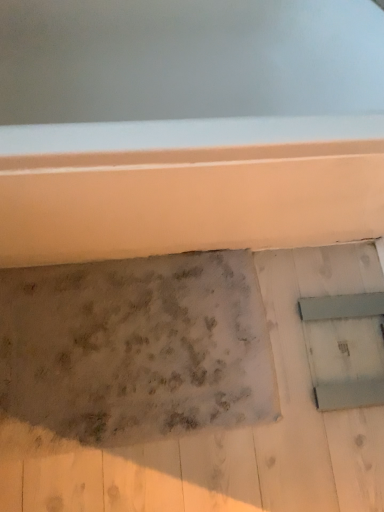
Locate an element on the screen. speckled concrete wall at center is located at coordinates (132, 350).

Image resolution: width=384 pixels, height=512 pixels. What do you see at coordinates (132, 350) in the screenshot? I see `speckled concrete wall at center` at bounding box center [132, 350].

Measure the distance between point [369,346] and camera.

Point [369,346] and camera are 4.05 feet apart.

The height and width of the screenshot is (512, 384). Identify the location of metallic gray window at lower right. (x=349, y=368).

The image size is (384, 512). What do you see at coordinates (349, 368) in the screenshot?
I see `metallic gray window at lower right` at bounding box center [349, 368].

Image resolution: width=384 pixels, height=512 pixels. I want to click on speckled concrete wall at center, so click(x=132, y=350).

Does speckled concrete wall at center appear on the right side of metallic gray window at lower right?

In fact, speckled concrete wall at center is to the left of metallic gray window at lower right.

In the image, is speckled concrete wall at center positioned in front of or behind metallic gray window at lower right?

speckled concrete wall at center is positioned closer to the viewer than metallic gray window at lower right.

From the picture: Which is nearer, (154,304) or (315,326)?

Clearly, point (154,304) is closer to the camera than point (315,326).

From the image's perspective, which object appears higher, speckled concrete wall at center or metallic gray window at lower right?

From the image's view, metallic gray window at lower right is above.

From a real-world perspective, is speckled concrete wall at center over metallic gray window at lower right?

No, from a real-world perspective, speckled concrete wall at center is not over metallic gray window at lower right

Considering the sizes of speckled concrete wall at center and metallic gray window at lower right in the image, is speckled concrete wall at center wider or thinner than metallic gray window at lower right?

Considering their sizes, speckled concrete wall at center looks broader than metallic gray window at lower right.

Considering the sizes of speckled concrete wall at center and metallic gray window at lower right in the image, is speckled concrete wall at center taller or shorter than metallic gray window at lower right?

speckled concrete wall at center is taller than metallic gray window at lower right.

Is speckled concrete wall at center bigger than metallic gray window at lower right?

Indeed, speckled concrete wall at center has a larger size compared to metallic gray window at lower right.

Would you say speckled concrete wall at center is inside or outside metallic gray window at lower right?

The correct answer is: outside.

Are speckled concrete wall at center and metallic gray window at lower right beside each other?

No, speckled concrete wall at center is not making contact with metallic gray window at lower right.

Is speckled concrete wall at center turned away from metallic gray window at lower right?

speckled concrete wall at center does not have its back to metallic gray window at lower right.

How many degrees apart are the facing directions of speckled concrete wall at center and metallic gray window at lower right?

179 degrees separate the facing orientations of speckled concrete wall at center and metallic gray window at lower right.

Measure the distance between speckled concrete wall at center and metallic gray window at lower right.

speckled concrete wall at center and metallic gray window at lower right are 15.84 inches apart from each other.

Identify the location of window behind the speckled concrete wall at center. (349, 368).

Considering the relative positions of metallic gray window at lower right and speckled concrete wall at center in the image provided, is metallic gray window at lower right to the right of speckled concrete wall at center from the viewer's perspective?

Indeed, metallic gray window at lower right is positioned on the right side of speckled concrete wall at center.

Is metallic gray window at lower right positioned before speckled concrete wall at center?

No, metallic gray window at lower right is behind speckled concrete wall at center.

Does point (355, 359) come closer to viewer compared to point (237, 281)?

Yes.

From the image's perspective, would you say metallic gray window at lower right is shown under speckled concrete wall at center?

No.

From a real-world perspective, who is located lower, metallic gray window at lower right or speckled concrete wall at center?

In real-world perspective, speckled concrete wall at center is lower.

Looking at this image, between metallic gray window at lower right and speckled concrete wall at center, which one has smaller width?

metallic gray window at lower right is thinner.

Considering the relative sizes of metallic gray window at lower right and speckled concrete wall at center in the image provided, is metallic gray window at lower right shorter than speckled concrete wall at center?

Yes.

Is metallic gray window at lower right bigger than speckled concrete wall at center?

Actually, metallic gray window at lower right might be smaller than speckled concrete wall at center.

Is metallic gray window at lower right inside the boundaries of speckled concrete wall at center, or outside?

metallic gray window at lower right exists entirely within speckled concrete wall at center.

Is metallic gray window at lower right next to speckled concrete wall at center?

No, metallic gray window at lower right is not with speckled concrete wall at center.

Is metallic gray window at lower right facing towards speckled concrete wall at center?

Yes, metallic gray window at lower right is facing speckled concrete wall at center.

Consider the image. What's the angular difference between metallic gray window at lower right and speckled concrete wall at center's facing directions?

The facing directions of metallic gray window at lower right and speckled concrete wall at center are 179 degrees apart.

Measure the distance between metallic gray window at lower right and speckled concrete wall at center.

The distance of metallic gray window at lower right from speckled concrete wall at center is 40.22 centimeters.

Locate an element on the screen. window behind the speckled concrete wall at center is located at coordinates (349, 368).

I want to click on window to the right of speckled concrete wall at center, so click(x=349, y=368).

You are a GUI agent. You are given a task and a screenshot of the screen. Output one action in this format:
    pyautogui.click(x=<x>, y=<y>)
    Task: Click on the footprint in front of the metallic gray window at lower right
    The width and height of the screenshot is (384, 512).
    Given the screenshot: What is the action you would take?
    pyautogui.click(x=132, y=350)